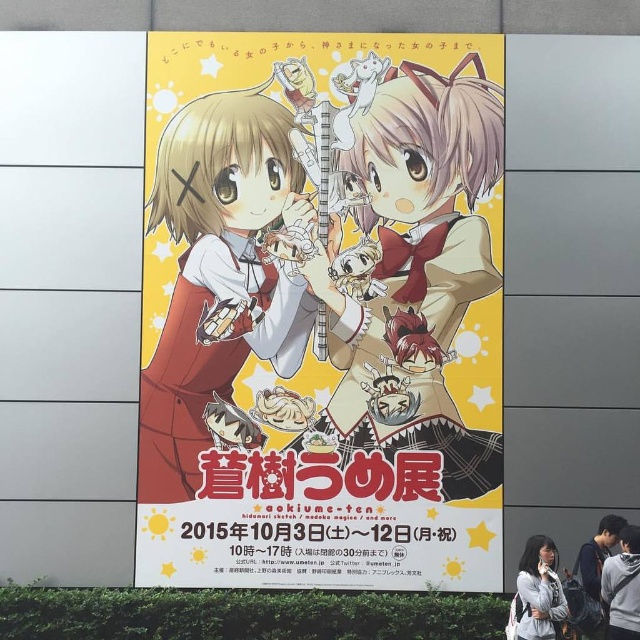
Can you confirm if matte red dress at center is thinner than gray hoodie at lower right?

No, matte red dress at center is not thinner than gray hoodie at lower right.

Does point (244, 268) come farther from viewer compared to point (625, 611)?

That is True.

Image resolution: width=640 pixels, height=640 pixels. What are the coordinates of `matte red dress at center` in the screenshot? It's located at (321, 310).

Which is below, matte red dress at center or dark gray hoodie at lower right?

Positioned lower is dark gray hoodie at lower right.

Is matte red dress at center closer to camera compared to dark gray hoodie at lower right?

No, matte red dress at center is further to the viewer.

Locate an element on the screen. The image size is (640, 640). matte red dress at center is located at coordinates (321, 310).

The height and width of the screenshot is (640, 640). I want to click on matte red dress at center, so click(x=321, y=310).

Between light gray fabric jacket at lower right and dark gray hoodie at lower right, which one is positioned lower?

dark gray hoodie at lower right

Is light gray fabric jacket at lower right to the right of dark gray hoodie at lower right from the viewer's perspective?

No, light gray fabric jacket at lower right is not to the right of dark gray hoodie at lower right.

Who is more distant from viewer, (561,621) or (582,609)?

Positioned behind is point (582,609).

I want to click on light gray fabric jacket at lower right, so click(538, 592).